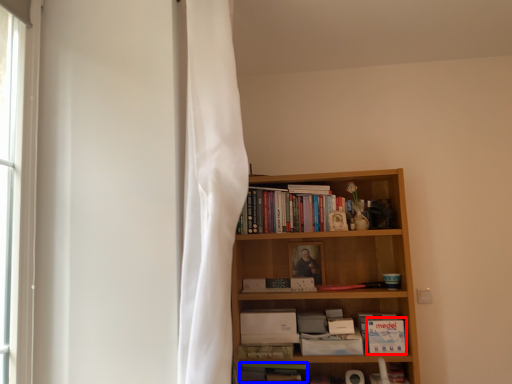
Question: Which point is further to the camera, paperback book (highlighted by a red box) or book (highlighted by a blue box)?

Choices:
 (A) paperback book
 (B) book

Answer: (B)